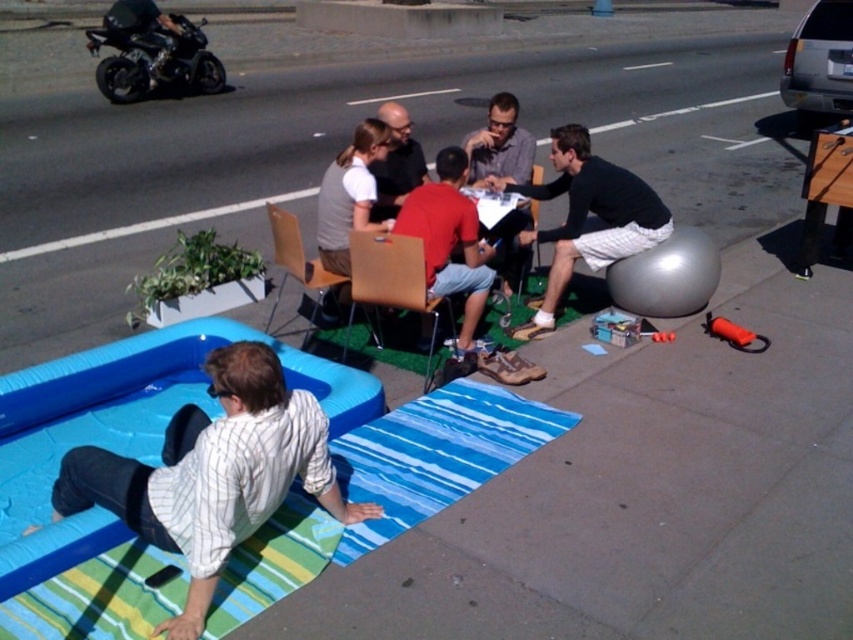
Is the position of black cotton shirt at center more distant than that of wooden chair at center?

No, it is not.

Image resolution: width=853 pixels, height=640 pixels. What do you see at coordinates (585, 216) in the screenshot? I see `black cotton shirt at center` at bounding box center [585, 216].

At what (x,y) coordinates should I click in order to perform the action: click on black cotton shirt at center. Please return your answer as a coordinate pair (x, y). This screenshot has width=853, height=640. Looking at the image, I should click on (585, 216).

Can you confirm if matte red shirt at center is positioned above matte gray shirt at center?

No, matte red shirt at center is not above matte gray shirt at center.

Find the location of a particular element. matte red shirt at center is located at coordinates (450, 241).

I want to click on matte red shirt at center, so click(450, 241).

Is white striped shirt at lower left shorter than matte gray shirt at center?

No.

Is the position of white striped shirt at lower left less distant than that of matte gray shirt at center?

Yes, white striped shirt at lower left is closer to the viewer.

Between point (364, 515) and point (483, 168), which one is positioned behind?

The point (483, 168) is behind.

The image size is (853, 640). Identify the location of white striped shirt at lower left. (213, 474).